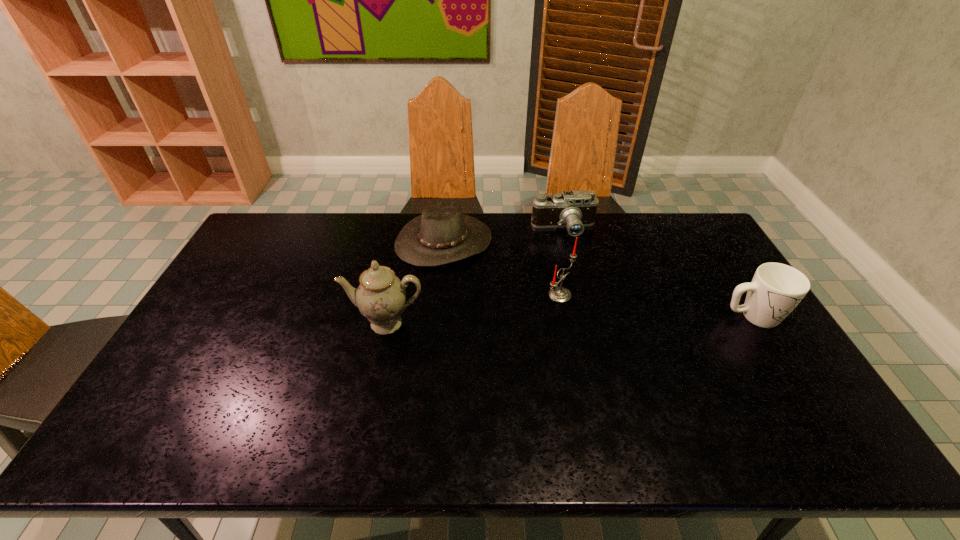
Where is `vacant space located on the front-facing side of the hat`? The height and width of the screenshot is (540, 960). vacant space located on the front-facing side of the hat is located at coordinates (526, 329).

The height and width of the screenshot is (540, 960). What are the coordinates of `blank area located 0.330m on the front-facing side of the hat` in the screenshot? It's located at pyautogui.click(x=526, y=329).

Identify the location of free space located 0.300m on the front-facing side of the candle. The width and height of the screenshot is (960, 540). pyautogui.click(x=677, y=342).

Where is `free space located on the front-facing side of the candle`? The height and width of the screenshot is (540, 960). free space located on the front-facing side of the candle is located at coordinates (598, 312).

This screenshot has width=960, height=540. Identify the location of free point located on the front-facing side of the candle. (631, 325).

At what (x,y) coordinates should I click in order to perform the action: click on camera situated at the far edge. Please return your answer as a coordinate pair (x, y). The width and height of the screenshot is (960, 540). Looking at the image, I should click on (574, 210).

Find the location of `hat at the far edge`. hat at the far edge is located at coordinates (442, 234).

Locate an element on the screen. object that is positioned at the right edge is located at coordinates (776, 289).

Where is `vacant point at the far edge`? This screenshot has height=540, width=960. vacant point at the far edge is located at coordinates (360, 212).

The width and height of the screenshot is (960, 540). What are the coordinates of `vacant space at the near edge of the desktop` in the screenshot? It's located at (744, 399).